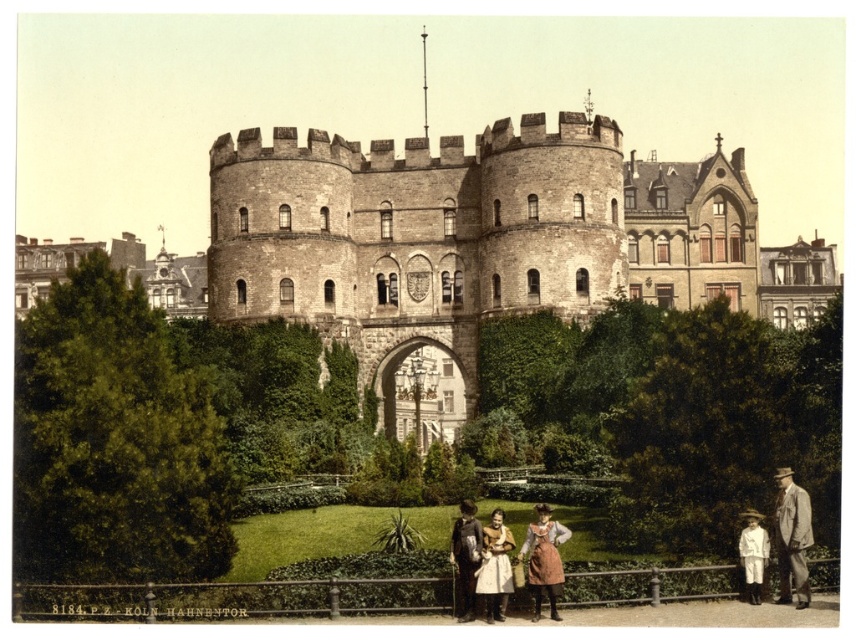
Does light brown suit at lower right have a greater width compared to white cotton dress at center?

Yes, light brown suit at lower right is wider than white cotton dress at center.

Who is more forward, (x=789, y=577) or (x=507, y=531)?

Point (x=789, y=577) is more forward.

Does point (792, 506) lie behind point (506, 552)?

That is True.

Locate an element on the screen. light brown suit at lower right is located at coordinates (791, 538).

This screenshot has height=640, width=856. Describe the element at coordinates (495, 566) in the screenshot. I see `white cotton dress at center` at that location.

This screenshot has height=640, width=856. Identify the location of white cotton dress at center. (495, 566).

In order to click on white cotton dress at center in this screenshot , I will do `click(495, 566)`.

Is light brown suit at lower right to the left of white cotton shirt at lower right from the viewer's perspective?

In fact, light brown suit at lower right is to the right of white cotton shirt at lower right.

Can you confirm if light brown suit at lower right is positioned above white cotton shirt at lower right?

Yes.

Which is in front, point (801, 513) or point (747, 560)?

Point (801, 513) is in front.

At what (x,y) coordinates should I click in order to perform the action: click on light brown suit at lower right. Please return your answer as a coordinate pair (x, y). The width and height of the screenshot is (856, 640). Looking at the image, I should click on (791, 538).